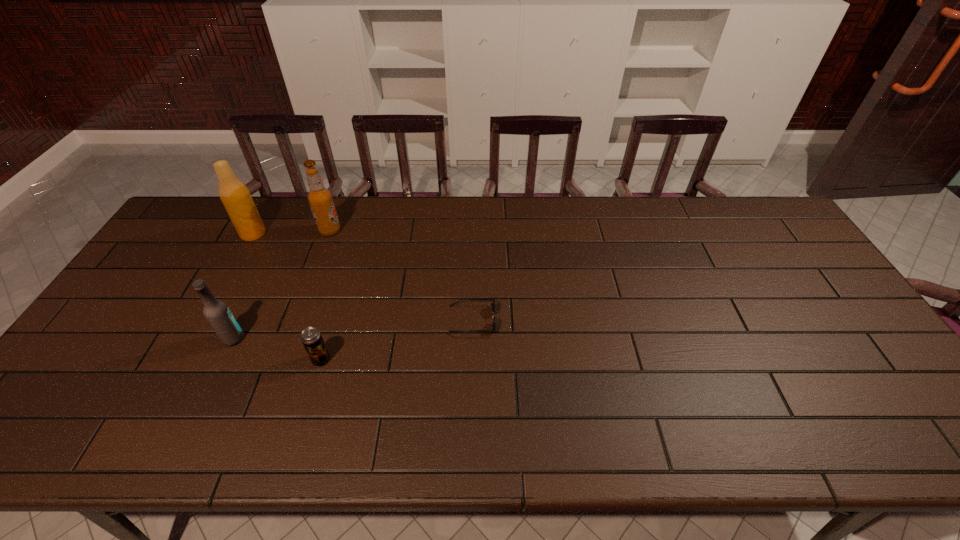
I want to click on vacant space located on the side of the fourth object from right to left with the label, so click(x=309, y=339).

You are a GUI agent. You are given a task and a screenshot of the screen. Output one action in this format:
    pyautogui.click(x=<x>, y=<y>)
    Task: Click on the vacant space situated on the back of the fourth tallest object
    
    Given the screenshot: What is the action you would take?
    pyautogui.click(x=338, y=302)

Locate an element on the screen. The image size is (960, 540). free spot located 0.310m on the front-facing side of the sunglasses is located at coordinates (609, 320).

Where is `free space at the far edge`? The width and height of the screenshot is (960, 540). free space at the far edge is located at coordinates [x=355, y=214].

The image size is (960, 540). I want to click on blank space at the left edge of the desktop, so click(203, 253).

Image resolution: width=960 pixels, height=540 pixels. In the image, there is a desktop. In order to click on vacant space at the right edge in this screenshot , I will do `click(780, 259)`.

Identify the location of free space at the near left corner of the desktop. (73, 418).

The image size is (960, 540). Find the location of `free space at the far right corner of the desktop`. free space at the far right corner of the desktop is located at coordinates pos(778,226).

The image size is (960, 540). In order to click on free space between the third object from right to left and the beer can in this screenshot , I will do `click(325, 295)`.

The width and height of the screenshot is (960, 540). Identify the location of free point between the nearest beer bottle and the nearest object. (277, 349).